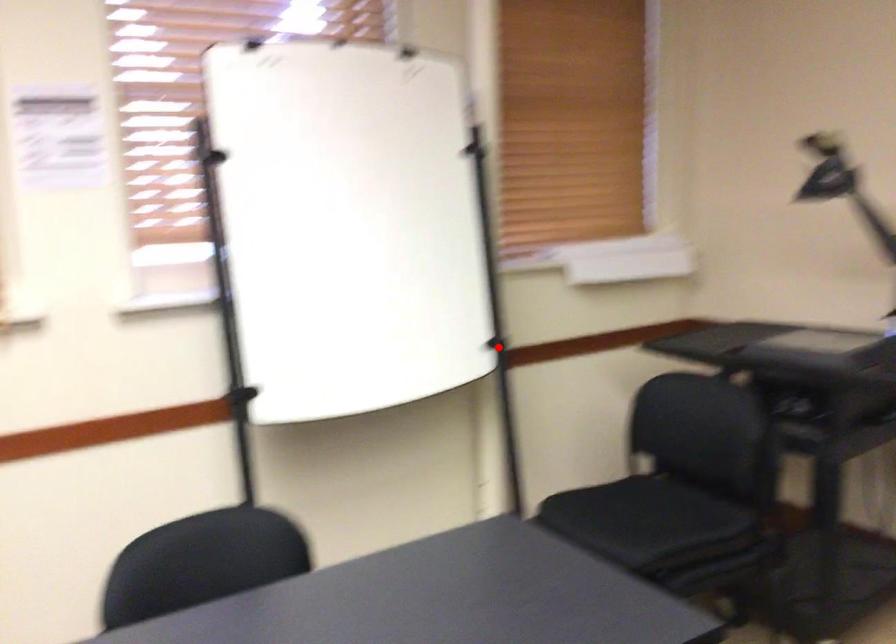
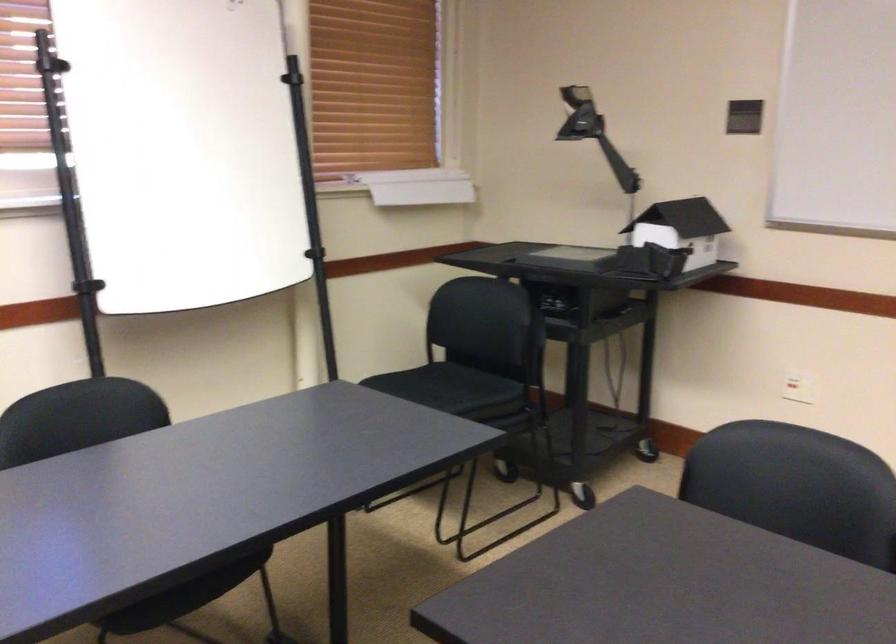
Question: I am providing you with two images of the same scene from different viewpoints. Image1 has a red point marked. In image2, the corresponding 3D location appears at what relative position? Reply with the corresponding letter.

Choices:
 (A) Closer
 (B) Farther

Answer: (B)